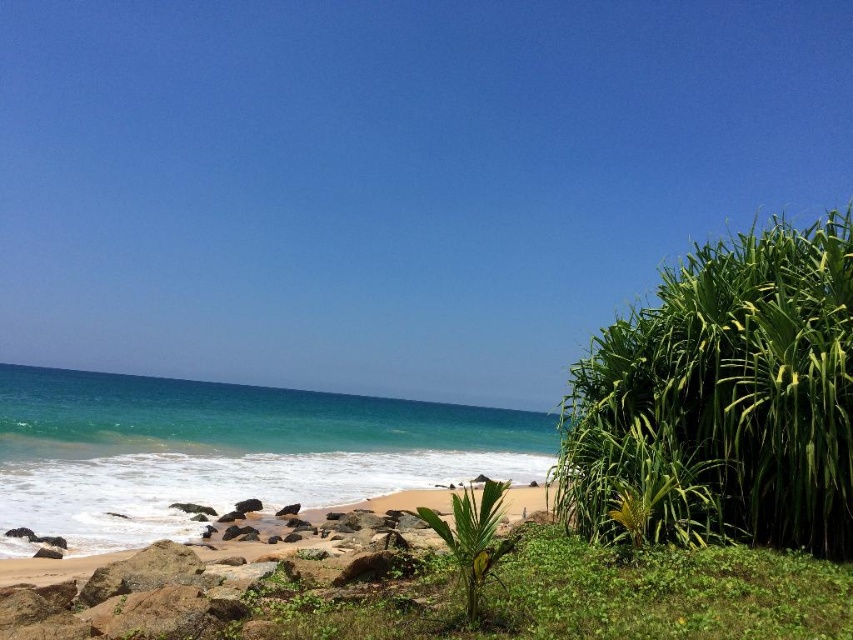
Locate an element on the screen. The width and height of the screenshot is (853, 640). turquoise glossy water at center is located at coordinates (225, 451).

Which is behind, point (85, 460) or point (68, 572)?

Point (85, 460)

Is point (18, 365) positioned after point (38, 566)?

Yes, it is.

Where is `turquoise glossy water at center`? turquoise glossy water at center is located at coordinates (225, 451).

Locate an element on the screen. The height and width of the screenshot is (640, 853). green leafy bush at right is located at coordinates (724, 397).

Is green leafy bush at right closer to camera compared to turquoise glossy water at center?

Yes.

Which is in front, point (801, 531) or point (138, 481)?

Positioned in front is point (801, 531).

The height and width of the screenshot is (640, 853). Find the location of `green leafy bush at right`. green leafy bush at right is located at coordinates (724, 397).

Can you confirm if green leafy bush at right is wider than brown sandy beach at lower left?

Incorrect, green leafy bush at right's width does not surpass brown sandy beach at lower left's.

Does green leafy bush at right have a lesser height compared to brown sandy beach at lower left?

No, green leafy bush at right is not shorter than brown sandy beach at lower left.

Measure the distance between green leafy bush at right and camera.

green leafy bush at right and camera are 6.35 meters apart from each other.

Locate an element on the screen. The height and width of the screenshot is (640, 853). green leafy bush at right is located at coordinates (724, 397).